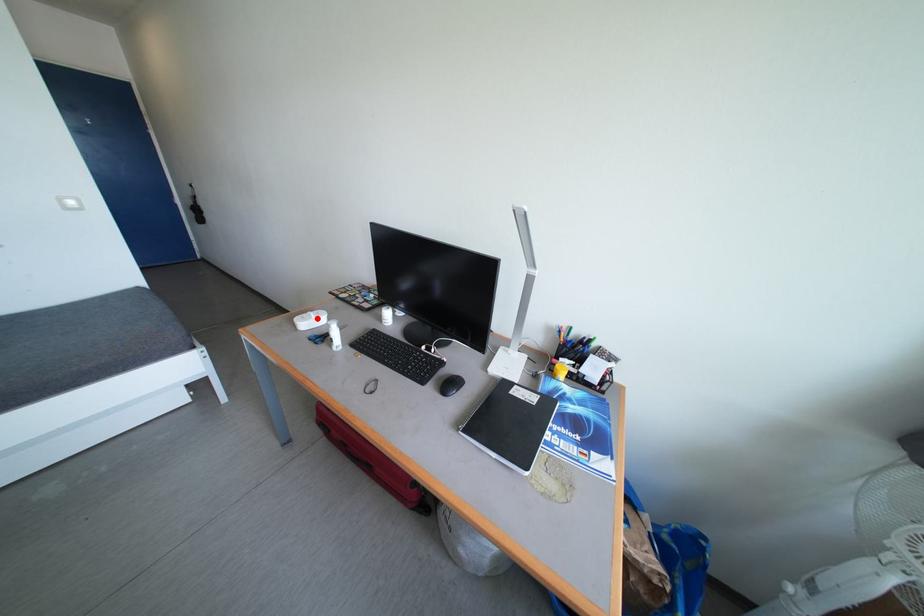
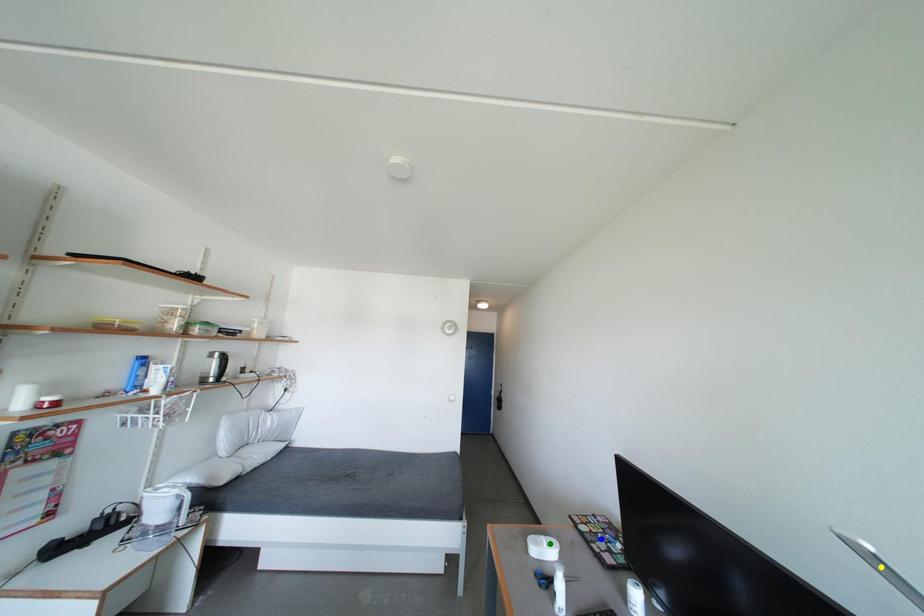
Question: I am providing you with two images of the same scene from different viewpoints. A red point is marked on the first image. You are given multiple points on the second image. Which mark in image 2 goes with the point in image 1?

Choices:
 (A) yellow point
 (B) green point
 (C) blue point

Answer: (B)